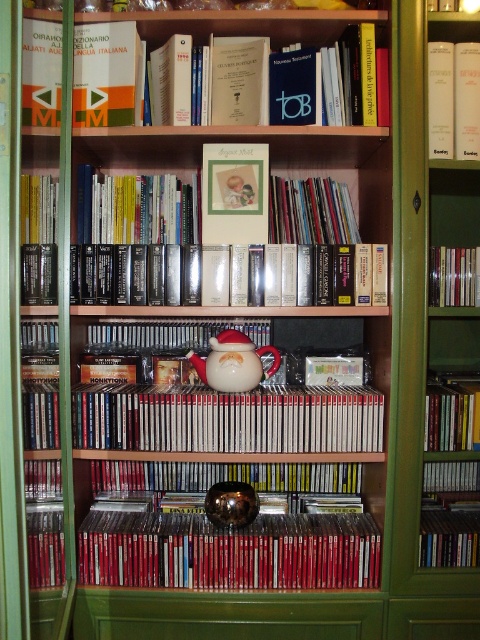
Question: Does metallic reflective ball at center appear on the right side of hardcover book at upper right?

Choices:
 (A) no
 (B) yes

Answer: (A)

Question: Which of the following is the farthest from the observer?

Choices:
 (A) (460, 404)
 (B) (469, 502)
 (C) (192, 531)

Answer: (B)

Question: Which point is farther from the camera taking this photo?

Choices:
 (A) (444, 113)
 (B) (434, 486)
 (C) (48, 525)

Answer: (B)

Question: Is hardcover book at upper right below hardcover book at left?

Choices:
 (A) yes
 (B) no

Answer: (B)

Question: Among these points, which one is nearest to the camera?

Choices:
 (A) (435, 408)
 (B) (434, 282)
 (C) (363, 563)

Answer: (C)

Question: From the image, what is the correct spatial relationship of metallic reflective ball at center in relation to hardcover book at upper right?

Choices:
 (A) right
 (B) left

Answer: (B)